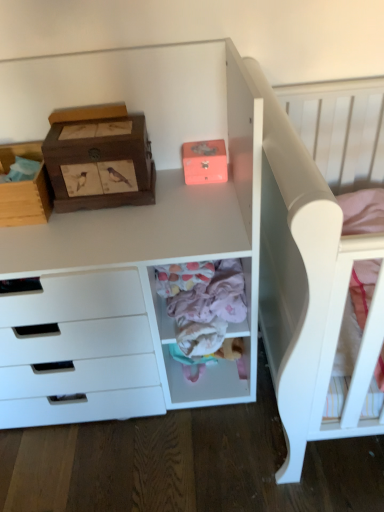
The width and height of the screenshot is (384, 512). Find the location of `white matte bed at upper right`. white matte bed at upper right is located at coordinates (307, 289).

What do you see at coordinates (122, 304) in the screenshot?
I see `white matte wooden desk at upper left` at bounding box center [122, 304].

Locate an element on the screen. pastel pink fabric at center is located at coordinates (219, 362).

Based on the photo, measure the distance between pastel pink fabric at center and camera.

pastel pink fabric at center and camera are 3.47 feet apart.

How much space does woodenmaterial/textureshoe box at upper left, the first shoe box viewed from the left, occupy horizontally?

7.62 inches.

Describe the element at coordinates (204, 162) in the screenshot. I see `matte pink shoe box at upper center, which is the second shoe box in left-to-right order` at that location.

Describe the element at coordinates (208, 379) in the screenshot. The height and width of the screenshot is (512, 384). I see `pastel pink fabric at lower center` at that location.

The height and width of the screenshot is (512, 384). Find the location of `pastel pink fabric at lower center`. pastel pink fabric at lower center is located at coordinates (208, 379).

The image size is (384, 512). I want to click on white matte bed at upper right, so click(x=307, y=289).

How much distance is there between woodenmaterial/textureshoe box at upper left, which appears as the 2th shoe box when viewed from the right, and wooden cardboard box at left?

They are 14.82 centimeters apart.

How different are the orientations of woodenmaterial/textureshoe box at upper left, which appears as the 2th shoe box when viewed from the right, and wooden cardboard box at left in degrees?

woodenmaterial/textureshoe box at upper left, which appears as the 2th shoe box when viewed from the right, and wooden cardboard box at left are facing 1.59 degrees away from each other.

Between woodenmaterial/textureshoe box at upper left, the first shoe box viewed from the left, and wooden cardboard box at left, which one appears on the right side from the viewer's perspective?

Positioned to the right is woodenmaterial/textureshoe box at upper left, the first shoe box viewed from the left.

From a real-world perspective, who is located higher, woodenmaterial/textureshoe box at upper left, the first shoe box viewed from the left, or wooden cardboard box at left?

woodenmaterial/textureshoe box at upper left, the first shoe box viewed from the left.

Is white matte wooden desk at upper left oriented away from matte pink shoe box at upper center, which is the second shoe box in left-to-right order?

Yes.

Who is taller, white matte wooden desk at upper left or matte pink shoe box at upper center, the first shoe box when ordered from right to left?

white matte wooden desk at upper left is taller.

Which object is closer to the camera taking this photo, white matte wooden desk at upper left or matte pink shoe box at upper center, the first shoe box when ordered from right to left?

white matte wooden desk at upper left is more forward.

Could matte pink shoe box at upper center, the first shoe box when ordered from right to left, be considered to be inside white matte wooden desk at upper left?

Yes, matte pink shoe box at upper center, the first shoe box when ordered from right to left, is surrounded by white matte wooden desk at upper left.

Is pastel pink fabric at center surrounding woodenmaterial/textureshoe box at upper left, the first shoe box viewed from the left?

No.

Looking at this image, is pastel pink fabric at center positioned far away from woodenmaterial/textureshoe box at upper left, which appears as the 2th shoe box when viewed from the right?

No.

Is pastel pink fabric at center wider than woodenmaterial/textureshoe box at upper left, which appears as the 2th shoe box when viewed from the right?

Yes.

Which is in front, point (158, 354) or point (91, 166)?

The point (91, 166) is in front.

From the picture: Considering the relative positions of pastel pink fabric at lower center and pastel pink fabric at center in the image provided, is pastel pink fabric at lower center to the left of pastel pink fabric at center from the viewer's perspective?

No, pastel pink fabric at lower center is not to the left of pastel pink fabric at center.

Is pastel pink fabric at lower center wider than pastel pink fabric at center?

Incorrect, the width of pastel pink fabric at lower center does not surpass that of pastel pink fabric at center.

Is pastel pink fabric at lower center placed right next to pastel pink fabric at center?

Yes, pastel pink fabric at lower center is beside pastel pink fabric at center.

Is pastel pink fabric at lower center situated inside pastel pink fabric at center or outside?

pastel pink fabric at lower center is not enclosed by pastel pink fabric at center.

Is white matte bed at upper right turned away from wooden cardboard box at left?

white matte bed at upper right is not turned away from wooden cardboard box at left.

Is white matte bed at upper right located outside wooden cardboard box at left?

Yes, white matte bed at upper right is not within wooden cardboard box at left.

Is white matte bed at upper right smaller than wooden cardboard box at left?

Actually, white matte bed at upper right might be larger than wooden cardboard box at left.

Identify the location of cardboard box positioned vertically above the white matte bed at upper right (from a real-world perspective). 24,188.

Can you tell me how much matte pink shoe box at upper center, the first shoe box when ordered from right to left, and woodenmaterial/textureshoe box at upper left, which appears as the 2th shoe box when viewed from the right, differ in facing direction?

matte pink shoe box at upper center, the first shoe box when ordered from right to left, and woodenmaterial/textureshoe box at upper left, which appears as the 2th shoe box when viewed from the right, are facing 1.6 degrees away from each other.

From a real-world perspective, is matte pink shoe box at upper center, the first shoe box when ordered from right to left, physically above woodenmaterial/textureshoe box at upper left, the first shoe box viewed from the left?

No, from a real-world perspective, matte pink shoe box at upper center, the first shoe box when ordered from right to left, is not on top of woodenmaterial/textureshoe box at upper left, the first shoe box viewed from the left.

Which is nearer, [220,178] or [140,185]?

Point [140,185]

From the image's perspective, which object appears higher, matte pink shoe box at upper center, the first shoe box when ordered from right to left, or woodenmaterial/textureshoe box at upper left, the first shoe box viewed from the left?

matte pink shoe box at upper center, the first shoe box when ordered from right to left, from the image's perspective.

From a real-world perspective, between pastel pink fabric at center and wooden cardboard box at left, who is vertically lower?

From a 3D spatial view, pastel pink fabric at center is below.

Would you say pastel pink fabric at center is inside or outside wooden cardboard box at left?

pastel pink fabric at center is not inside wooden cardboard box at left, it's outside.

What's the angular difference between pastel pink fabric at center and wooden cardboard box at left's facing directions?

The facing directions of pastel pink fabric at center and wooden cardboard box at left are 1.38 degrees apart.

Looking at their sizes, would you say pastel pink fabric at center is wider or thinner than wooden cardboard box at left?

pastel pink fabric at center is wider than wooden cardboard box at left.

You are a GUI agent. You are given a task and a screenshot of the screen. Output one action in this format:
    pyautogui.click(x=<x>, y=<y>)
    Task: Click on the shoe box in front of the wooden cardboard box at left
    This screenshot has height=512, width=384.
    Given the screenshot: What is the action you would take?
    pyautogui.click(x=99, y=158)

From a real-world perspective, starting from the white matte wooden desk at upper left, which shoe box is the 1st one vertically above it? Please provide its 2D coordinates.

[(204, 162)]

Looking at the image, which one is located closer to white matte wooden desk at upper left, white matte bed at upper right or pastel pink fabric at center?

pastel pink fabric at center.

From the image, which object appears to be farther from wooden cardboard box at left, pastel pink fabric at center or pastel pink fabric at lower center?

pastel pink fabric at lower center is positioned further to the anchor wooden cardboard box at left.

From the image, which object appears to be nearer to white matte bed at upper right, pastel pink fabric at center or woodenmaterial/textureshoe box at upper left, which appears as the 2th shoe box when viewed from the right?

pastel pink fabric at center lies closer to white matte bed at upper right than the other object.

Looking at the image, which one is located further to pastel pink fabric at lower center, white matte bed at upper right or white matte wooden desk at upper left?

The object further to pastel pink fabric at lower center is white matte bed at upper right.

From the image, which object appears to be farther from white matte wooden desk at upper left, woodenmaterial/textureshoe box at upper left, the first shoe box viewed from the left, or matte pink shoe box at upper center, the first shoe box when ordered from right to left?

matte pink shoe box at upper center, the first shoe box when ordered from right to left, is further to white matte wooden desk at upper left.

When comparing their distances from matte pink shoe box at upper center, the first shoe box when ordered from right to left, does white matte bed at upper right or wooden cardboard box at left seem further?

The object further to matte pink shoe box at upper center, the first shoe box when ordered from right to left, is white matte bed at upper right.

From the picture: Estimate the real-world distances between objects in this image. Which object is closer to pastel pink fabric at lower center, wooden cardboard box at left or white matte bed at upper right?

Based on the image, white matte bed at upper right appears to be nearer to pastel pink fabric at lower center.

When comparing their distances from white matte bed at upper right, does pastel pink fabric at center or matte pink shoe box at upper center, which is the second shoe box in left-to-right order, seem further?

The object further to white matte bed at upper right is matte pink shoe box at upper center, which is the second shoe box in left-to-right order.

In order to click on computer desk between woodenmaterial/textureshoe box at upper left, which appears as the 2th shoe box when viewed from the right, and pastel pink fabric at center vertically in this screenshot , I will do pyautogui.click(x=122, y=304).

Locate an element on the screen. computer desk between wooden cardboard box at left and white matte bed at upper right in the horizontal direction is located at coordinates (122, 304).

Identify the location of shoe box between wooden cardboard box at left and matte pink shoe box at upper center, the first shoe box when ordered from right to left. This screenshot has width=384, height=512. point(99,158).

Where is `computer desk located between wooden cardboard box at left and matte pink shoe box at upper center, the first shoe box when ordered from right to left, in the left-right direction`? computer desk located between wooden cardboard box at left and matte pink shoe box at upper center, the first shoe box when ordered from right to left, in the left-right direction is located at coordinates (122, 304).